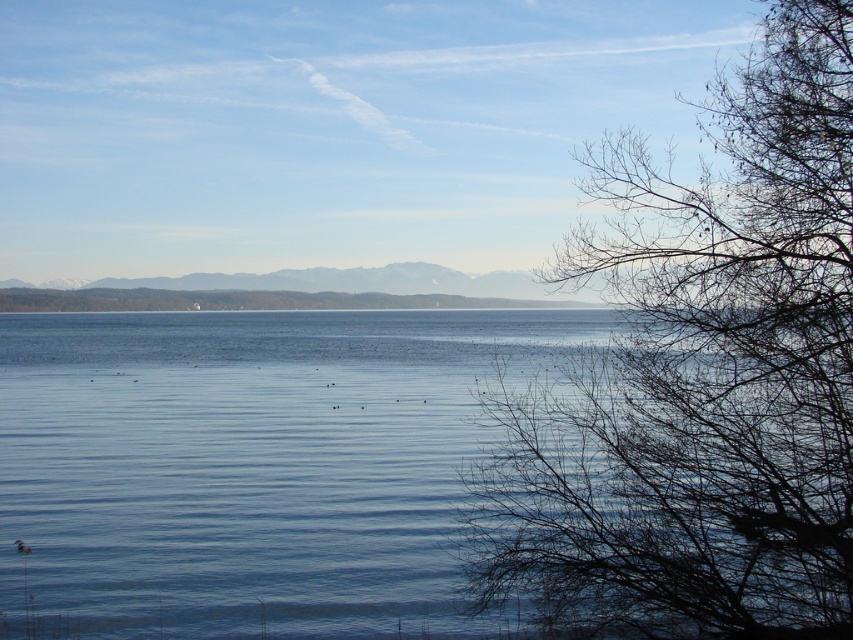
Question: Is bare branches at right above blue water at center?

Choices:
 (A) yes
 (B) no

Answer: (A)

Question: Is bare branches at right further to the viewer compared to blue water at center?

Choices:
 (A) yes
 (B) no

Answer: (B)

Question: Among these points, which one is farthest from the camera?

Choices:
 (A) (650, 216)
 (B) (167, 353)

Answer: (B)

Question: Is bare branches at right positioned behind blue water at center?

Choices:
 (A) no
 (B) yes

Answer: (A)

Question: Which of the following is the farthest from the observer?

Choices:
 (A) (142, 604)
 (B) (634, 317)

Answer: (A)